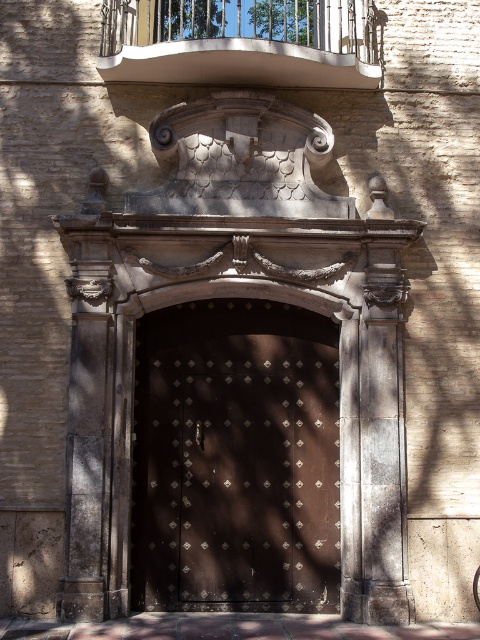
Can you confirm if dark brown metal door at center is smaller than white metal balcony at upper center?

Yes.

Is dark brown metal door at center above white metal balcony at upper center?

Actually, dark brown metal door at center is below white metal balcony at upper center.

Where is `dark brown metal door at center`? This screenshot has width=480, height=640. dark brown metal door at center is located at coordinates (236, 458).

Identify the location of dark brown metal door at center. The width and height of the screenshot is (480, 640). (236, 458).